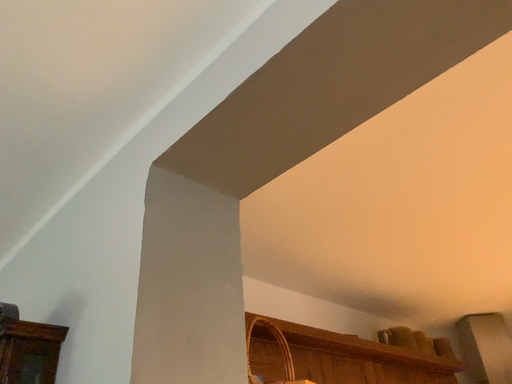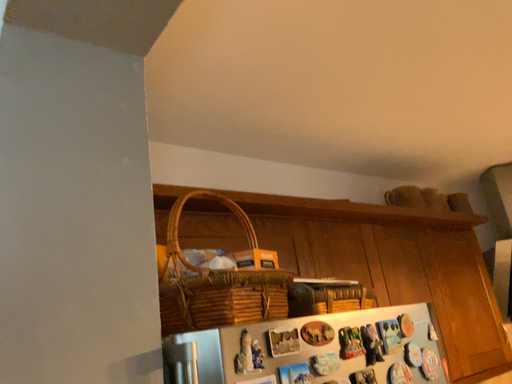
Question: How did the camera likely rotate when shooting the video?

Choices:
 (A) rotated downward
 (B) rotated upward

Answer: (A)